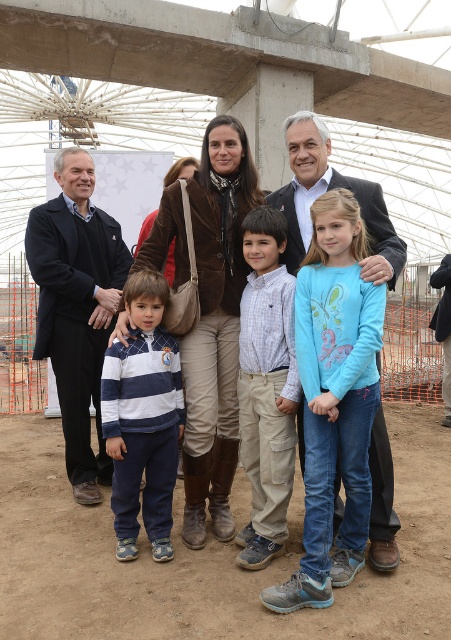
Question: Which is farther from the navy blue striped sweater at lower left?

Choices:
 (A) brown leather jacket at center
 (B) blue cotton shirt at center
 (C) plaid shirt at center

Answer: (B)

Question: Does brown leather jacket at center have a greater width compared to plaid shirt at center?

Choices:
 (A) no
 (B) yes

Answer: (B)

Question: Based on their relative distances, which object is farther from the dark suit at center?

Choices:
 (A) dark blue suit at center
 (B) brown dirt field at lower center
 (C) plaid shirt at center

Answer: (B)

Question: Can you confirm if brown leather jacket at center is positioned to the left of dark suit at center?

Choices:
 (A) no
 (B) yes

Answer: (B)

Question: Does brown dirt field at lower center lie behind dark blue suit at center?

Choices:
 (A) yes
 (B) no

Answer: (B)

Question: Considering the real-world distances, which object is closest to the dark suit at center?

Choices:
 (A) dark blue suit at center
 (B) plaid shirt at center
 (C) brown dirt field at lower center
 (D) blue cotton shirt at center

Answer: (D)